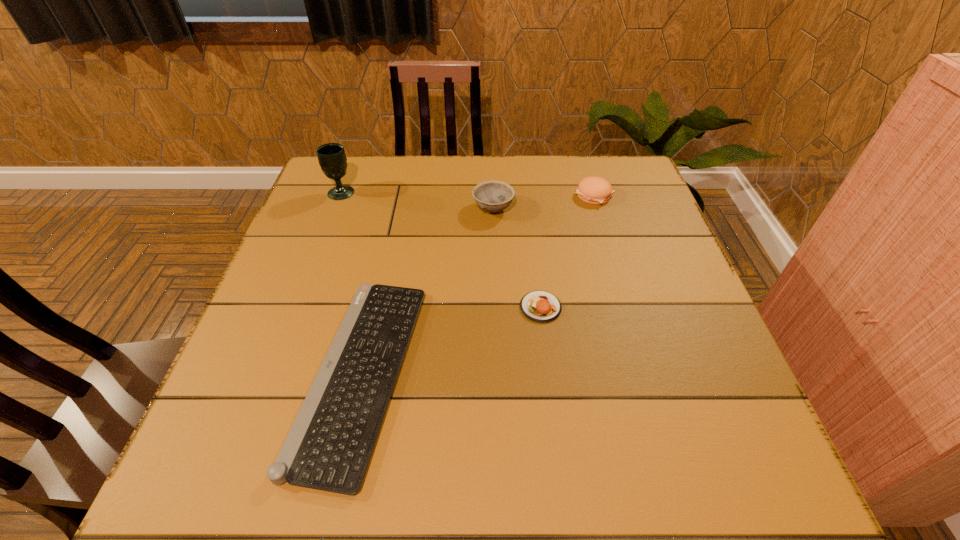
The image size is (960, 540). What are the coordinates of `free space located on the left of the right patty (food)` in the screenshot? It's located at [462, 195].

I want to click on free space located 0.070m on the left of the left patty (food), so click(x=488, y=307).

What are the coordinates of `vacant space situated 0.160m on the right of the second object from left to right` in the screenshot? It's located at (499, 373).

Find the location of a particular element. This screenshot has width=960, height=540. chalice at the far edge is located at coordinates (332, 159).

You are a GUI agent. You are given a task and a screenshot of the screen. Output one action in this format:
    pyautogui.click(x=<x>, y=<y>)
    Task: Click on the bowl present at the far edge
    
    Given the screenshot: What is the action you would take?
    pyautogui.click(x=493, y=196)

The width and height of the screenshot is (960, 540). What are the coordinates of `patty that is at the far edge` in the screenshot? It's located at (594, 190).

Find the location of `object that is at the near edge`. object that is at the near edge is located at coordinates (329, 446).

Where is `chalice situated at the left edge`? The image size is (960, 540). chalice situated at the left edge is located at coordinates (332, 159).

Locate an element on the screen. The height and width of the screenshot is (540, 960). computer keyboard at the left edge is located at coordinates (329, 446).

Find the location of `object at the right edge`. object at the right edge is located at coordinates (594, 190).